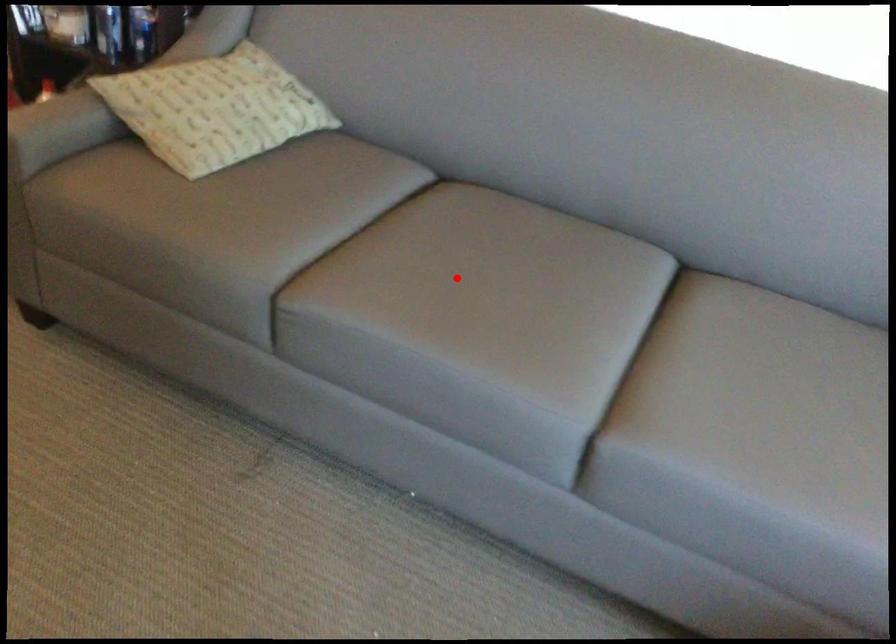
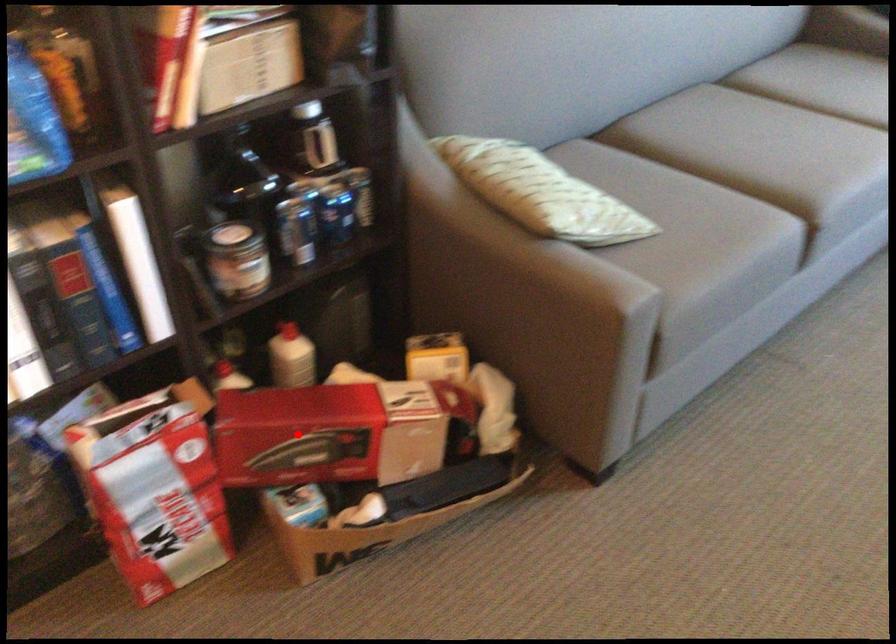
I am providing you with two images of the same scene from different viewpoints. A red point is marked on the first image and another point is marked on the second image. Is the marked point in image1 the same physical position as the marked point in image2?

No